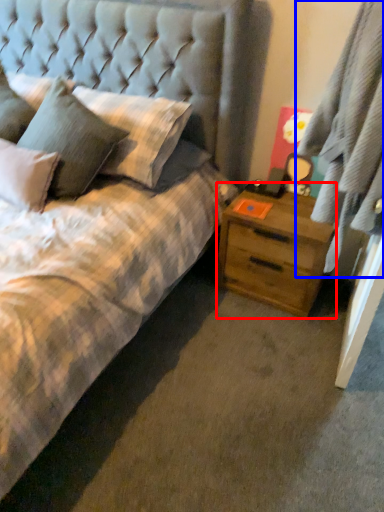
Question: Which point is closer to the camera, nightstand (highlighted by a red box) or curtain (highlighted by a blue box)?

Choices:
 (A) nightstand
 (B) curtain

Answer: (B)